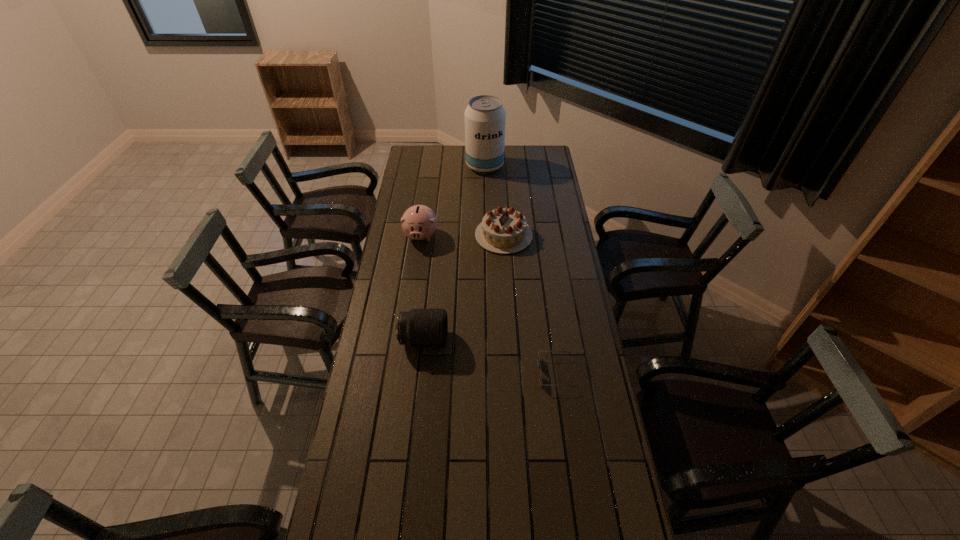
Find the location of a particular element. This screenshot has width=960, height=540. vacant area located 0.230m on the left of the birthday cake is located at coordinates (425, 235).

This screenshot has height=540, width=960. I want to click on vacant area situated on the front-facing side of the nearest object, so click(479, 373).

Locate an element on the screen. This screenshot has width=960, height=540. blank space located on the front-facing side of the nearest object is located at coordinates (485, 373).

Where is `free region located on the front-facing side of the nearest object`? This screenshot has width=960, height=540. free region located on the front-facing side of the nearest object is located at coordinates (433, 373).

This screenshot has width=960, height=540. In order to click on object positioned at the far edge in this screenshot , I will do `click(485, 117)`.

Where is `piggy bank that is at the left edge`? piggy bank that is at the left edge is located at coordinates (419, 222).

Locate an element on the screen. The image size is (960, 540). telephoto lens present at the left edge is located at coordinates (419, 327).

The width and height of the screenshot is (960, 540). I want to click on object located at the right edge, so click(x=539, y=365).

Find the location of a particular element. The height and width of the screenshot is (540, 960). free space at the left edge of the desktop is located at coordinates [405, 168].

At what (x,y) coordinates should I click in order to perform the action: click on blank area at the right edge. Please return your answer as a coordinate pair (x, y). Looking at the image, I should click on (567, 287).